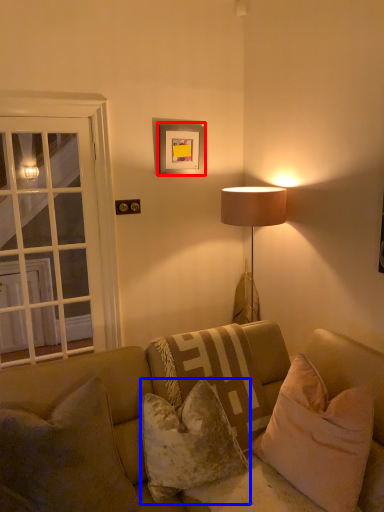
Question: Among these objects, which one is farthest to the camera, picture frame (highlighted by a red box) or pillow (highlighted by a blue box)?

Choices:
 (A) picture frame
 (B) pillow

Answer: (A)